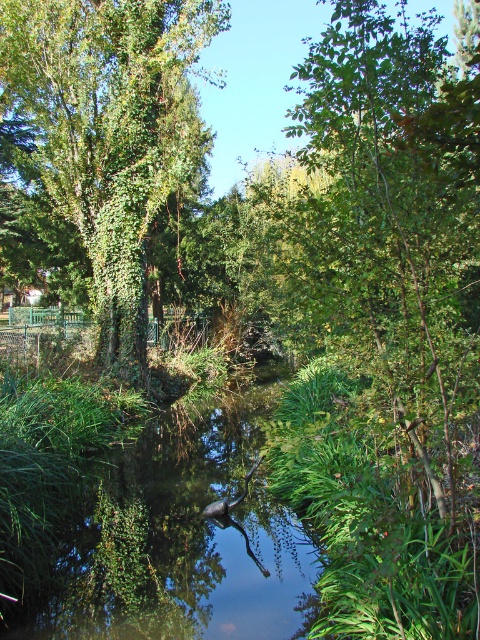
Question: Which point is closer to the camera?

Choices:
 (A) green ivy-covered tree at center
 (B) green leafy tree at center

Answer: (B)

Question: Is the position of green leafy tree at center more distant than that of green ivy-covered tree at center?

Choices:
 (A) yes
 (B) no

Answer: (B)

Question: Which point is closer to the camera?

Choices:
 (A) (458, 384)
 (B) (63, 198)

Answer: (A)

Question: Does green leafy tree at center appear on the right side of green ivy-covered tree at center?

Choices:
 (A) no
 (B) yes

Answer: (B)

Question: Does green leafy tree at center have a smaller size compared to green ivy-covered tree at center?

Choices:
 (A) no
 (B) yes

Answer: (A)